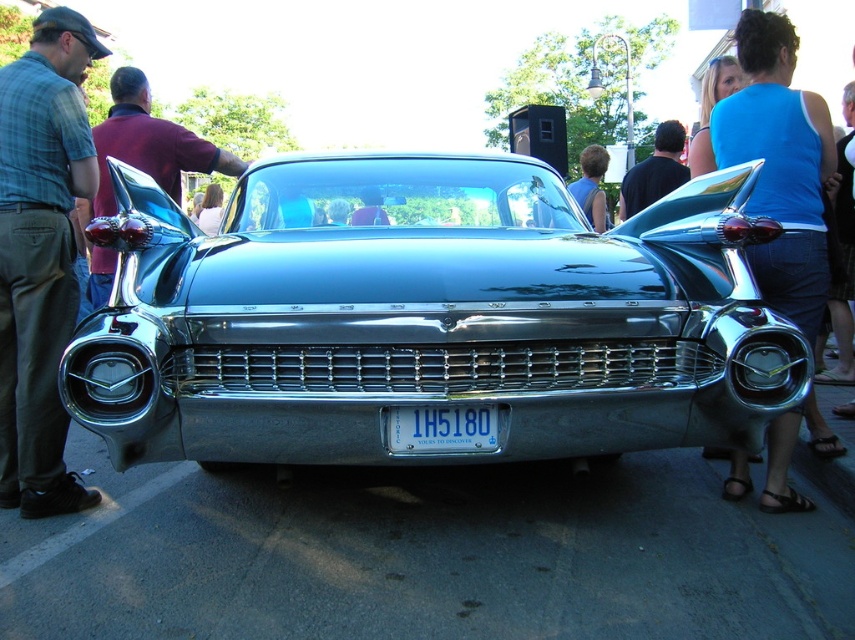
You are standing in front of the classic car and want to take a photo. The car has two points marked on its surface, one at point coordinates point (158, 240) and another at point coordinates point (665, 129). Which point will appear larger in your photo?

Point (158, 240) is closer to the camera than point (665, 129), so it will appear larger in the photo.

You are attending an outdoor car show and notice two shirts hanging on the back of a car seat. The shirts are the green plaid shirt at left and the maroon fabric shirt at left. Which shirt is positioned lower on the car seat?

The green plaid shirt at left is located below the maroon fabric shirt at left, so it is positioned lower on the car seat.

You are standing at the center of the image. A shiny chrome car is located at point (428, 316). Is the car positioned to your left, right, front, or back?

The shiny chrome car at center is positioned at point (428, 316), which is the center of the image. Therefore, the car is directly in front of you.